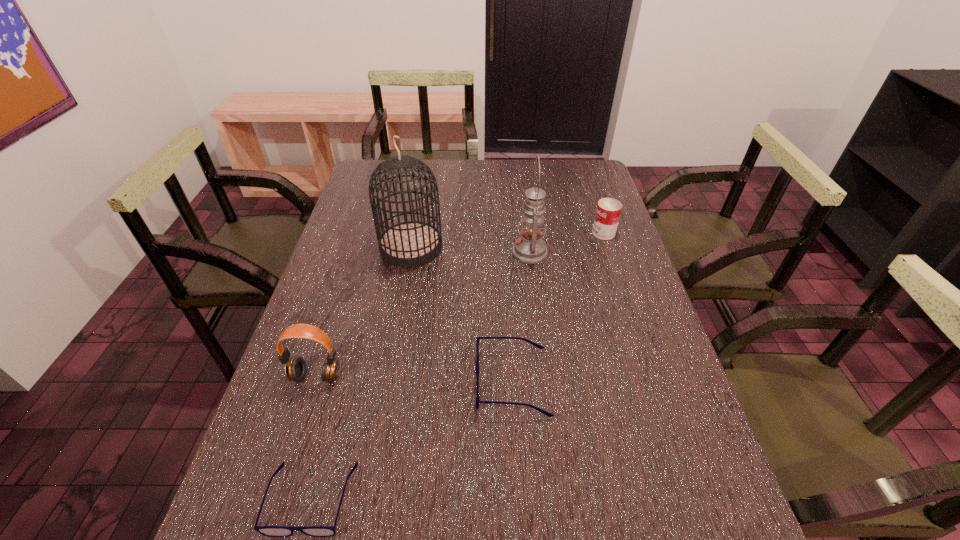
Select which object is the second closest to the oil lamp. Please provide its 2D coordinates. Your answer should be formatted as a tuple, i.e. [(x, y)], where the tuple contains the x and y coordinates of a point satisfying the conditions above.

[(412, 243)]

This screenshot has height=540, width=960. In order to click on object that ranks as the fifth closest to the headset in this screenshot , I will do 608,211.

Locate an element on the screen. This screenshot has width=960, height=540. free space that satisfies the following two spatial constraints: 1. on the front-facing side of the taller spectacles; 2. on the front-facing side of the nearer spectacles is located at coordinates (519, 498).

This screenshot has width=960, height=540. In order to click on vacant space that satisfies the following two spatial constraints: 1. on the front label of the rightmost object; 2. on the front-facing side of the shorter spectacles in this screenshot , I will do `click(693, 498)`.

Image resolution: width=960 pixels, height=540 pixels. I want to click on vacant space that satisfies the following two spatial constraints: 1. on the front label of the fourth tallest object; 2. on the ear cups of the fourth shortest object, so click(x=652, y=376).

This screenshot has width=960, height=540. What are the coordinates of `free spot that satisfies the following two spatial constraints: 1. on the front label of the rightmost object; 2. on the front side of the birdcage` in the screenshot? It's located at (609, 247).

This screenshot has height=540, width=960. Find the location of `vacant space that satisfies the following two spatial constraints: 1. on the front side of the oil lamp; 2. on the front-facing side of the taller spectacles`. vacant space that satisfies the following two spatial constraints: 1. on the front side of the oil lamp; 2. on the front-facing side of the taller spectacles is located at coordinates coord(546,382).

Locate an element on the screen. This screenshot has height=540, width=960. vacant position in the image that satisfies the following two spatial constraints: 1. on the front side of the oil lamp; 2. on the front-facing side of the taller spectacles is located at coordinates (546, 382).